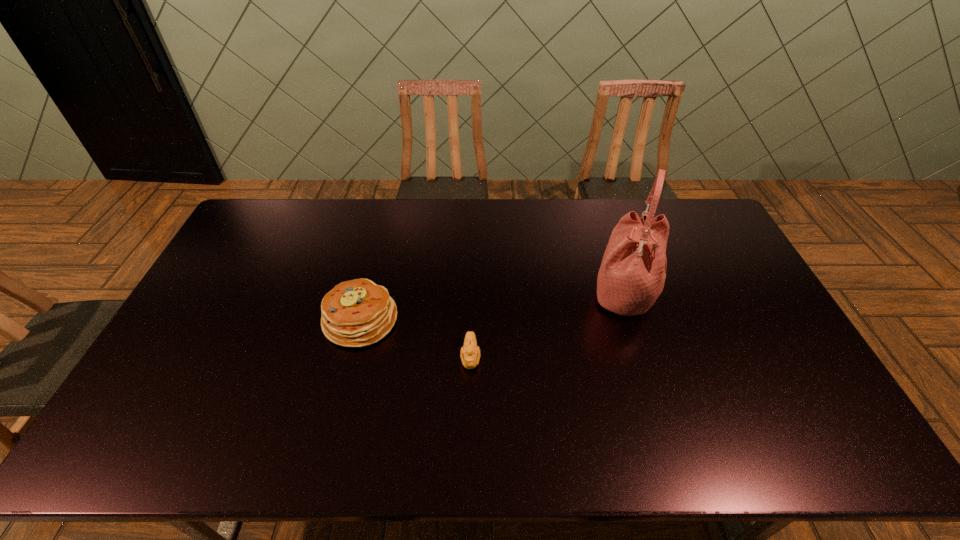
Identify the location of free space at the right edge. (805, 372).

Identify the location of free region at the far left corner. The image size is (960, 540). (276, 199).

Locate an element on the screen. The image size is (960, 540). blank area at the far right corner is located at coordinates (679, 200).

What are the coordinates of `free space between the handbag and the pancake` in the screenshot? It's located at (492, 306).

At what (x,y) coordinates should I click in order to perform the action: click on free spot between the second tallest object and the duckling. Please return your answer as a coordinate pair (x, y). Looking at the image, I should click on (416, 339).

You are a GUI agent. You are given a task and a screenshot of the screen. Output one action in this format:
    pyautogui.click(x=<x>, y=<y>)
    Task: Click on the empty location between the second shortest object and the second object from right to left
    This screenshot has width=960, height=540.
    Given the screenshot: What is the action you would take?
    pyautogui.click(x=416, y=339)

This screenshot has height=540, width=960. Find the location of `free space between the tallest object and the duckling`. free space between the tallest object and the duckling is located at coordinates (547, 325).

Find the location of `vacant space in between the leftmost object and the second object from left to right`. vacant space in between the leftmost object and the second object from left to right is located at coordinates (416, 339).

Find the location of a particular element. free point between the second object from left to right and the handbag is located at coordinates (547, 325).

At what (x,y) coordinates should I click in order to perform the action: click on blank region between the handbag and the leftmost object. Please return your answer as a coordinate pair (x, y). Looking at the image, I should click on (492, 306).